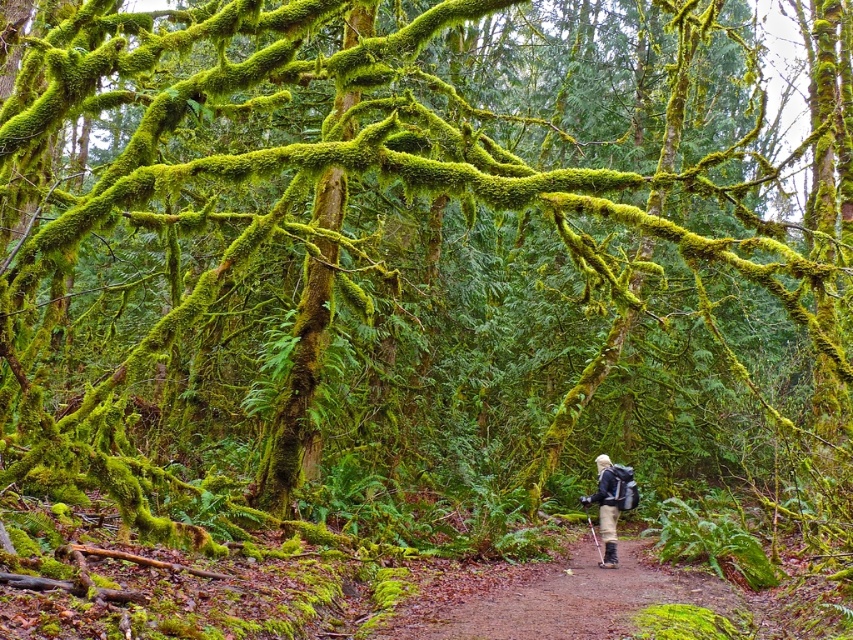
Question: Does brown dirt path at center appear under matte black backpack at center?

Choices:
 (A) no
 (B) yes

Answer: (B)

Question: Which point is closer to the camera?

Choices:
 (A) (601, 538)
 (B) (714, 582)

Answer: (B)

Question: Which point is closer to the camera?

Choices:
 (A) matte black backpack at center
 (B) brown dirt path at center

Answer: (B)

Question: Does brown dirt path at center have a greater width compared to matte black backpack at center?

Choices:
 (A) yes
 (B) no

Answer: (B)

Question: Does brown dirt path at center appear over matte black backpack at center?

Choices:
 (A) no
 (B) yes

Answer: (A)